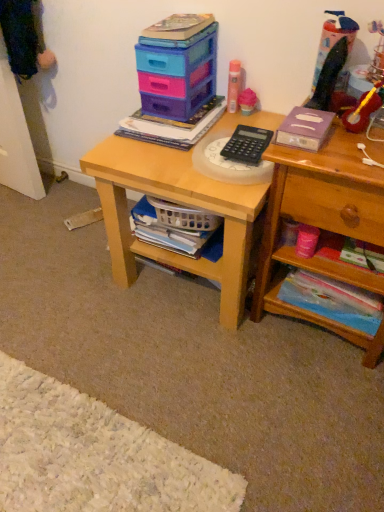
Question: In terms of width, does translucent plastic toy at upper right, the 3th toy from the left, look wider or thinner when compared to matte plastic book at center, the fourth book from the bottom?

Choices:
 (A) thin
 (B) wide

Answer: (A)

Question: Do you think translucent plastic toy at upper right, the 2th toy in the right-to-left sequence, is within matte plastic book at center, the fourth book from the bottom, or outside of it?

Choices:
 (A) inside
 (B) outside

Answer: (B)

Question: Which object is positioned farthest from the matte plastic book at center, the fourth book from the bottom?

Choices:
 (A) wooden at right
 (B) light wood desk at center
 (C) pink matte spray can at upper center, positioned as the first toy in left-to-right order
 (D) purple matte book at upper right, the 2th book in the top-to-bottom sequence
 (E) plastic storage boxes at upper center

Answer: (A)

Question: Based on their relative distances, which object is nearer to the translucent plastic toy at upper right, the 2th toy in the right-to-left sequence?

Choices:
 (A) wooden at right
 (B) white plastic basket at lower center, which ranks as the second book in bottom-to-top order
 (C) purple matte book at upper right, which is the 3th book from bottom to top
 (D) light wood desk at center
 (E) plastic storage boxes at upper center

Answer: (C)